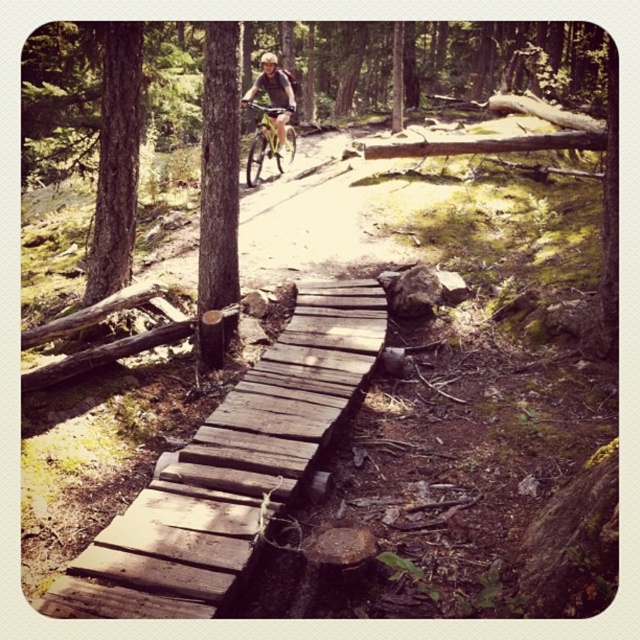
Is point (291, 385) farther from viewer compared to point (273, 60)?

No.

Who is more forward, (344, 301) or (266, 67)?

Point (344, 301) is more forward.

What do you see at coordinates (230, 468) in the screenshot? I see `weathered wooden bridge at center` at bounding box center [230, 468].

Where is `weathered wooden bridge at center`? weathered wooden bridge at center is located at coordinates (230, 468).

Which is behind, point (285, 90) or point (269, 60)?

The point (285, 90) is more distant.

Based on the photo, can you confirm if matte black helmet at upper center is positioned to the right of white matte helmet at upper center?

Correct, you'll find matte black helmet at upper center to the right of white matte helmet at upper center.

Does point (284, 115) lie behind point (260, 56)?

No, (284, 115) is in front of (260, 56).

Where is `matte black helmet at upper center`? The height and width of the screenshot is (640, 640). matte black helmet at upper center is located at coordinates (275, 100).

Between point (176, 579) and point (292, 84), which one is positioned behind?

Point (292, 84)

Between point (333, 316) and point (292, 99), which one is positioned in front?

Point (333, 316) is more forward.

Identify the location of weathered wooden bridge at center. The width and height of the screenshot is (640, 640). (230, 468).